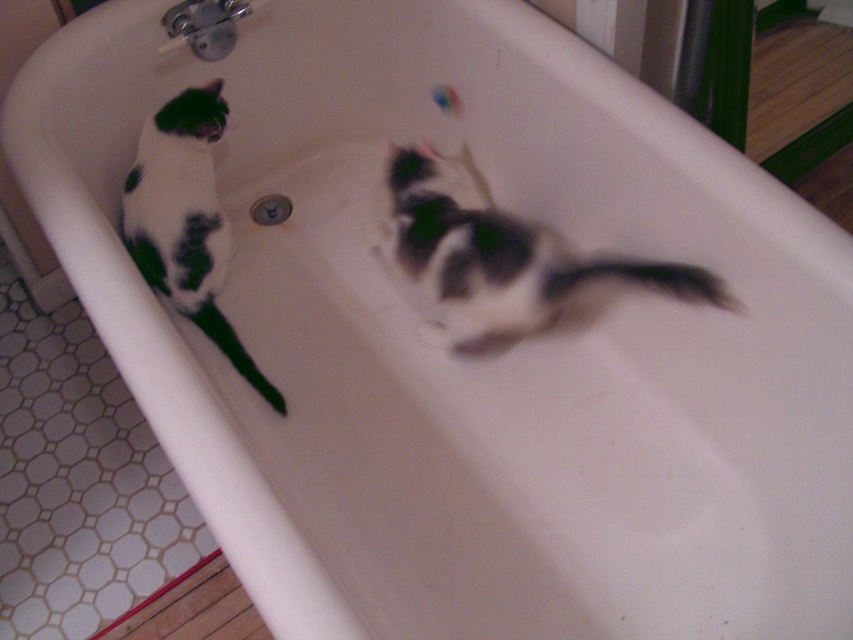
You are a photographer trying to capture a photo of the white fur cat at center. The camera is positioned at point A, which is at coordinates 0.300, 0.600. Will the cat be in the center of your photo if you take the shot from this position?

The white fur cat at center is located at point [502,256]. The camera is at [511,192]. Since the cat is slightly to the right and slightly below the camera position, it would not be perfectly centered in the photo. To center the cat, the camera should be positioned closer to the cat coordinates.